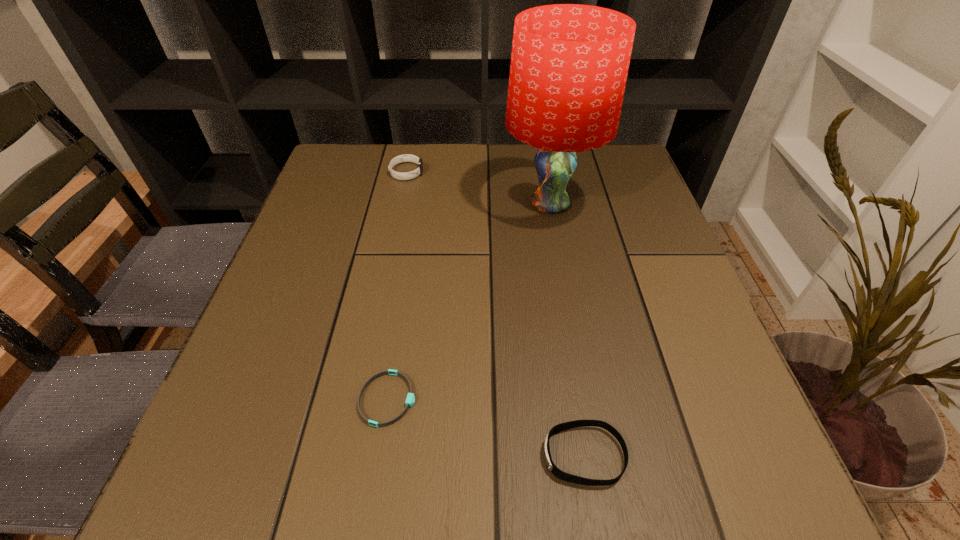
The height and width of the screenshot is (540, 960). Find the location of `lampshade`. lampshade is located at coordinates (569, 64).

You are a GUI agent. You are given a task and a screenshot of the screen. Output one action in this format:
    pyautogui.click(x=<x>, y=<y>)
    Task: Click on the farthest wristband
    
    Given the screenshot: What is the action you would take?
    pyautogui.click(x=406, y=157)

This screenshot has width=960, height=540. I want to click on the tallest wristband, so click(406, 157).

This screenshot has width=960, height=540. In order to click on the second tallest wristband in this screenshot , I will do `click(564, 476)`.

The height and width of the screenshot is (540, 960). I want to click on the third tallest object, so click(x=564, y=476).

I want to click on the shortest wristband, so click(410, 399).

The width and height of the screenshot is (960, 540). I want to click on vacant space situated on the front-facing side of the tallest object, so click(570, 318).

Find the location of a particular element. This screenshot has width=960, height=540. vacant space located 0.380m on the outer surface of the farthest wristband is located at coordinates (568, 172).

You are a GUI agent. You are given a task and a screenshot of the screen. Output one action in this format:
    pyautogui.click(x=<x>, y=<y>)
    Task: Click on the vacant area situated on the display of the third tallest object
    
    Given the screenshot: What is the action you would take?
    pyautogui.click(x=335, y=456)

The image size is (960, 540). Find the location of `vacant space located 0.180m on the display of the third tallest object`. vacant space located 0.180m on the display of the third tallest object is located at coordinates (419, 456).